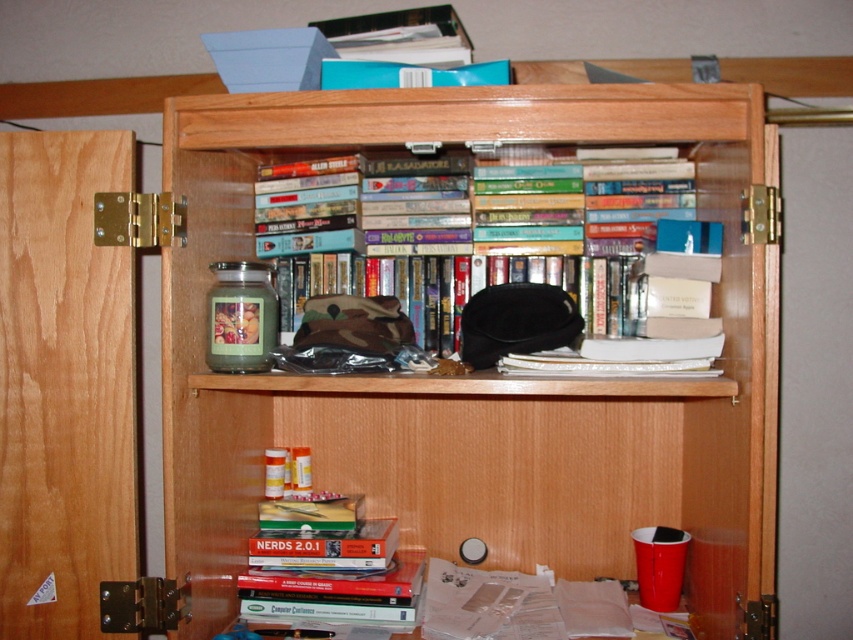
Does point (399, 520) lie behind point (675, 355)?

Yes, it is behind point (675, 355).

Who is taller, wooden bookshelf at upper center or hardcover books at upper center?

With more height is wooden bookshelf at upper center.

Identify the location of wooden bookshelf at upper center. This screenshot has height=640, width=853. (471, 372).

Locate an element on the screen. Image resolution: width=853 pixels, height=640 pixels. wooden bookshelf at upper center is located at coordinates (471, 372).